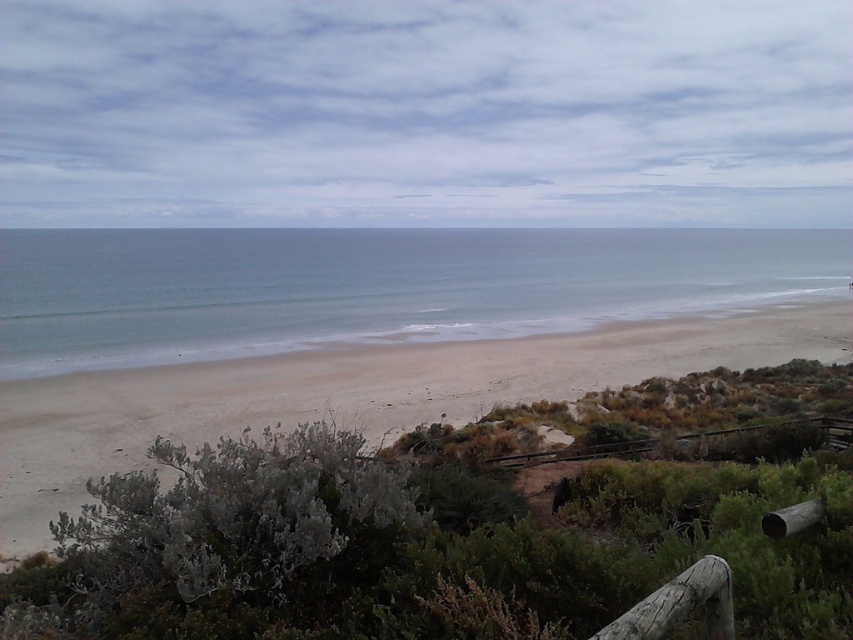
You are standing at the viewpoint overlooking the beach and want to reach the point marked as point (642,256). If your walking speed is 3 feet per second, how many seconds will it take you to reach that point?

The point (642,256) is 367.43 feet away from the camera. At a walking speed of 3 feet per second, it will take approximately 122.48 seconds to reach the point.

You are standing at the viewpoint overlooking the beach and see two points marked on the image. One is labeled as point (328, 241) and the other as point (440, 342). Which point is closer to you from your current position?

A: Point (440, 342) is closer to you because it is in front of point (328, 241) according to their spatial arrangement.

You are standing at the viewpoint overlooking the beach and want to determine which area is higher between the blue smooth water at center and the light brown sand at center. Based on the scene, which one is higher?

The blue smooth water at center has a greater height compared to the light brown sand at center, so the blue smooth water at center is higher.